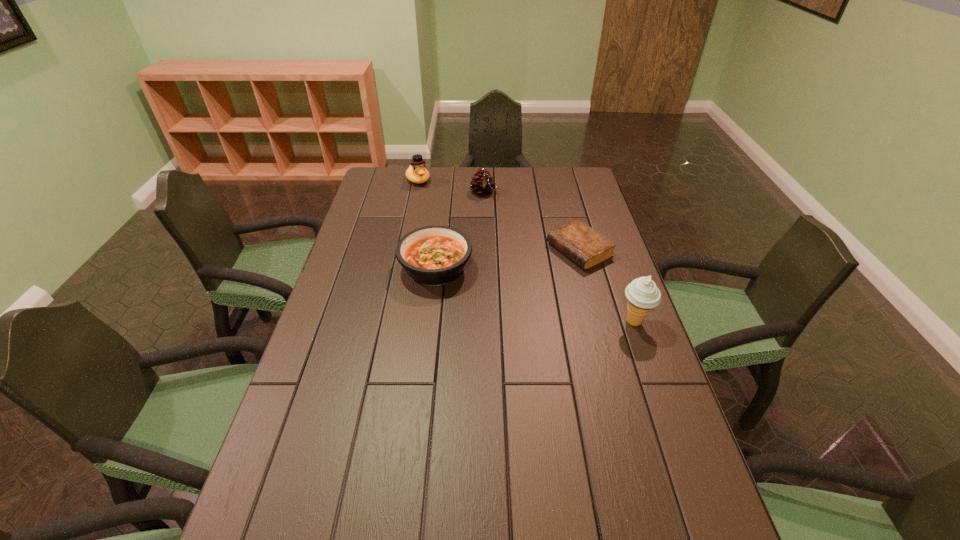
Find the location of a particular element. This screenshot has width=960, height=540. free spot between the duck and the nearest object is located at coordinates pos(526,251).

This screenshot has width=960, height=540. What are the coordinates of `vacant area between the duck and the shortest object` in the screenshot? It's located at (499, 215).

The height and width of the screenshot is (540, 960). Find the location of `vacant point located between the nearest object and the pinecone`. vacant point located between the nearest object and the pinecone is located at coordinates (559, 257).

Where is `free space between the fourth tallest object and the duck`? free space between the fourth tallest object and the duck is located at coordinates 427,224.

This screenshot has height=540, width=960. What are the coordinates of `free area in between the pinecone and the nearest object` in the screenshot? It's located at (559, 257).

Image resolution: width=960 pixels, height=540 pixels. What are the coordinates of `blank region between the diary and the pinecone` in the screenshot? It's located at (531, 221).

Locate an element on the screen. vacant region between the second shortest object and the pinecone is located at coordinates (459, 230).

You are a GUI agent. You are given a task and a screenshot of the screen. Output one action in this format:
    pyautogui.click(x=<x>, y=<y>)
    Task: Click on the vacant area that lies between the duck and the pinecone
    
    Given the screenshot: What is the action you would take?
    coord(450,186)

You are a GUI agent. You are given a task and a screenshot of the screen. Output one action in this format:
    pyautogui.click(x=<x>, y=<y>)
    Task: Click on the second closest object to the icecream
    
    Given the screenshot: What is the action you would take?
    pyautogui.click(x=432, y=255)

Select which object appears as the closest to the pinecone. Please provide its 2D coordinates. Your answer should be formatted as a tuple, i.e. [(x, y)], where the tuple contains the x and y coordinates of a point satisfying the conditions above.

[(416, 173)]